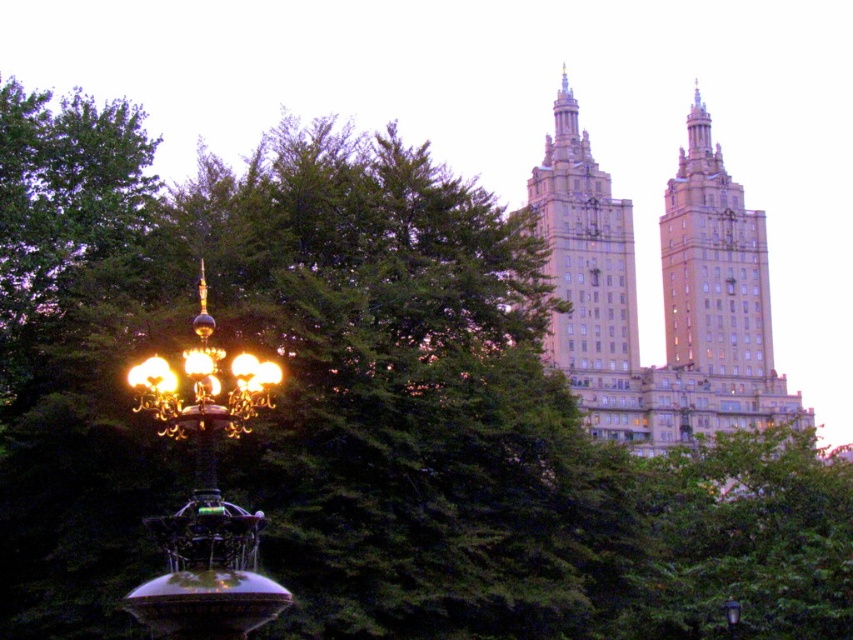
Question: Is beige stone tower at upper center wider than matte black street light at lower right?

Choices:
 (A) yes
 (B) no

Answer: (A)

Question: Which of the following is the farthest from the observer?

Choices:
 (A) (738, 604)
 (B) (624, 401)

Answer: (B)

Question: Does beige stone building at upper right appear on the right side of brown stone building at upper center?

Choices:
 (A) no
 (B) yes

Answer: (A)

Question: Which point is farther to the camera?

Choices:
 (A) gold metallic street light at lower left
 (B) matte black street light at lower right
 (C) brown stone building at upper center

Answer: (C)

Question: Is brown stone building at upper center closer to the viewer compared to matte black street light at lower right?

Choices:
 (A) no
 (B) yes

Answer: (A)

Question: Which point appears farthest from the camera in this image?

Choices:
 (A) (198, 448)
 (B) (561, 298)
 (C) (733, 630)

Answer: (B)